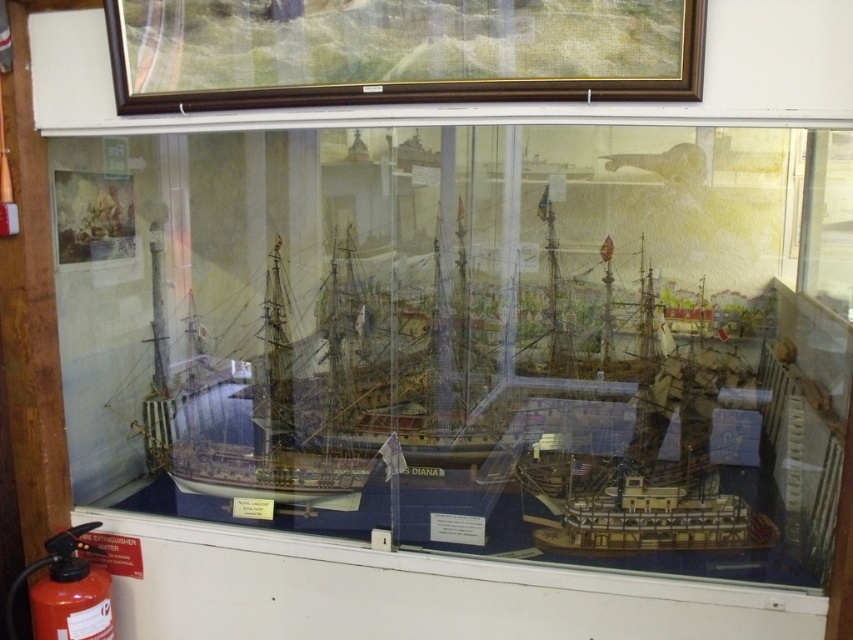
You are standing in front of a display case with a white wooden ship at center. The glass is slightly hazy. If you want to see the ship more clearly, should you move closer or farther away?

The white wooden ship at center is 7.87 feet away from the viewer. Moving closer would reduce the distance, potentially allowing for a clearer view by minimizing the effect of the hazy glass and reflections.

You are a visitor standing in front of the display case. You notice the wooden frame at upper center and the white wooden ship at center. Which object is located above the other?

The wooden frame at upper center is positioned over the white wooden ship at center, meaning it is above it.